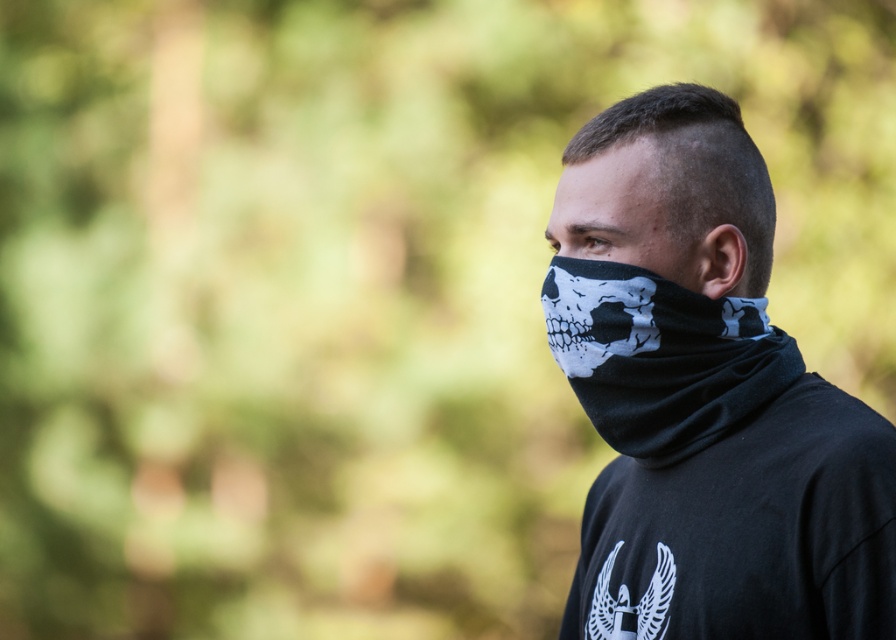
Looking at this image, between black fabric bandana at right and black matte bandana at center, which one is positioned lower?

Positioned lower is black fabric bandana at right.

Which of these two, black fabric bandana at right or black matte bandana at center, stands shorter?

black matte bandana at center

Based on the photo, who is more forward, (726, 211) or (687, 262)?

Point (687, 262)

This screenshot has height=640, width=896. What are the coordinates of `black fabric bandana at right` in the screenshot? It's located at (704, 397).